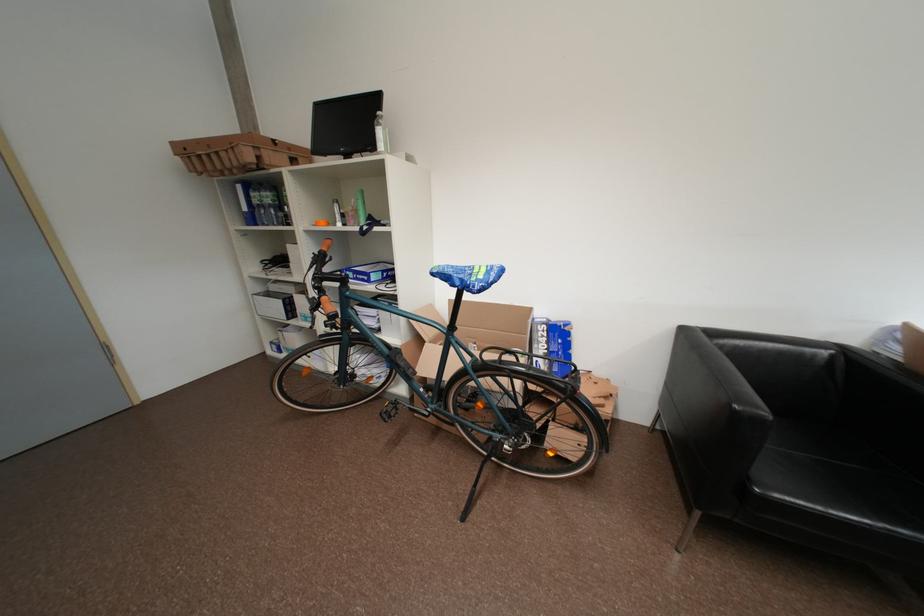
Locate an element on the screen. This screenshot has height=616, width=924. green spray bottle is located at coordinates (360, 207).